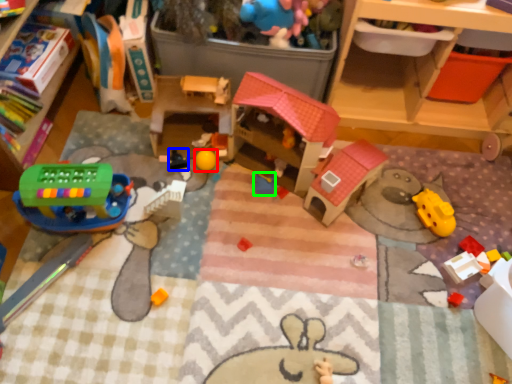
Question: Considering the real-world distances, which object is farthest from toy (highlighted by a red box)? toy (highlighted by a blue box) or toy (highlighted by a green box)?

Choices:
 (A) toy
 (B) toy

Answer: (B)